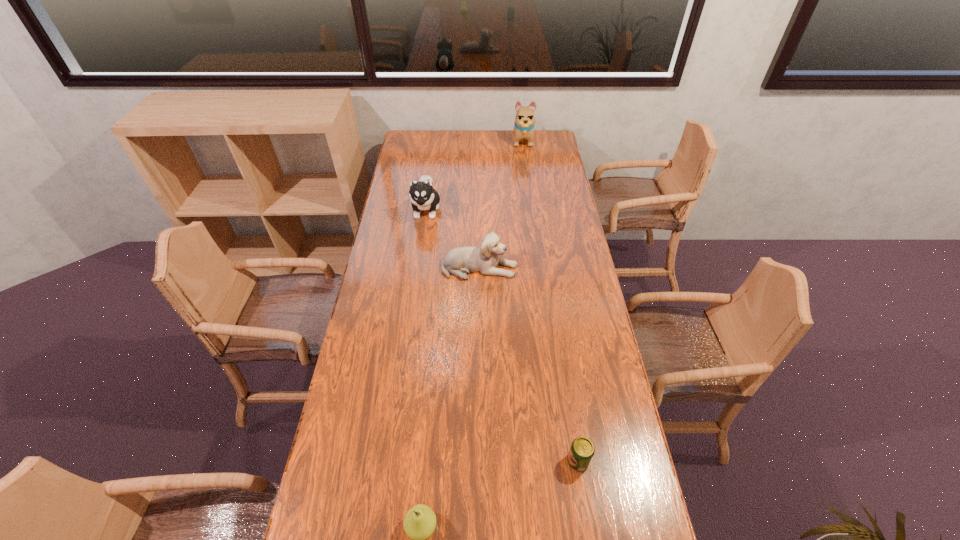
The height and width of the screenshot is (540, 960). Identify the location of vacant region that satisfies the following two spatial constraints: 1. at the face of the beer can; 2. on the left side of the second nearest puppy. (391, 461).

I want to click on vacant region that satisfies the following two spatial constraints: 1. at the face of the beer can; 2. on the left side of the second tallest puppy, so click(x=391, y=461).

This screenshot has width=960, height=540. Identify the location of free space that satisfies the following two spatial constraints: 1. on the front-facing side of the second puppy from left to right; 2. on the left side of the beer can. click(x=479, y=461).

Where is `free space that satisfies the following two spatial constraints: 1. on the back side of the shortest object; 2. on the front-facing side of the shortest puppy`? free space that satisfies the following two spatial constraints: 1. on the back side of the shortest object; 2. on the front-facing side of the shortest puppy is located at coordinates (548, 268).

Find the location of `vacant space that satisfies the following two spatial constraints: 1. at the face of the second farthest object; 2. on the left side of the fourth farthest object`. vacant space that satisfies the following two spatial constraints: 1. at the face of the second farthest object; 2. on the left side of the fourth farthest object is located at coordinates (391, 461).

Identify the location of vacant region that satisfies the following two spatial constraints: 1. at the face of the beer can; 2. on the left side of the leftmost puppy. (391, 461).